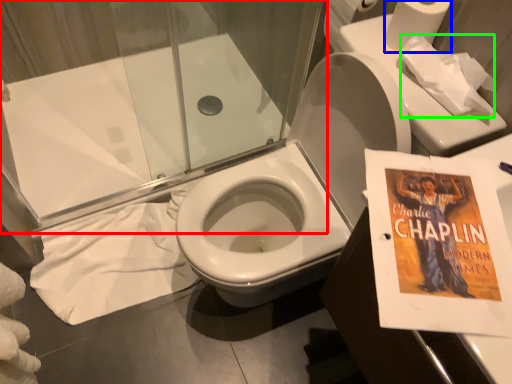
Question: Based on their relative distances, which object is farther from shower door (highlighted by a red box)? Choose from toilet paper (highlighted by a blue box) and toilet paper (highlighted by a green box).

Choices:
 (A) toilet paper
 (B) toilet paper

Answer: (B)